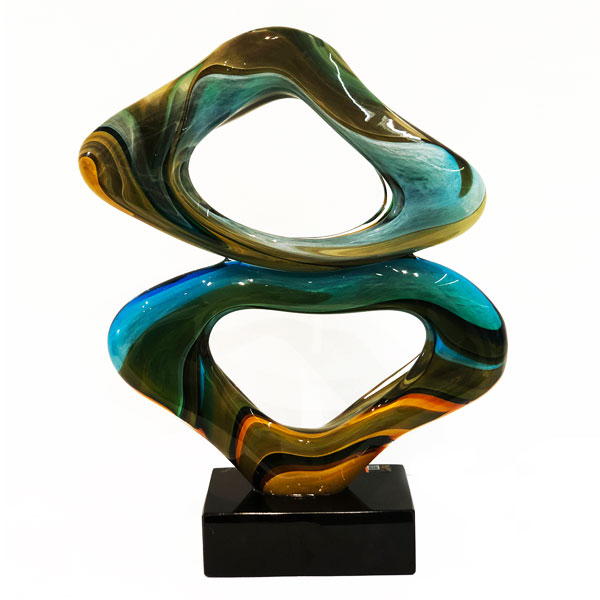
What are the coordinates of `artwork stand` in the screenshot? It's located at (337, 539).